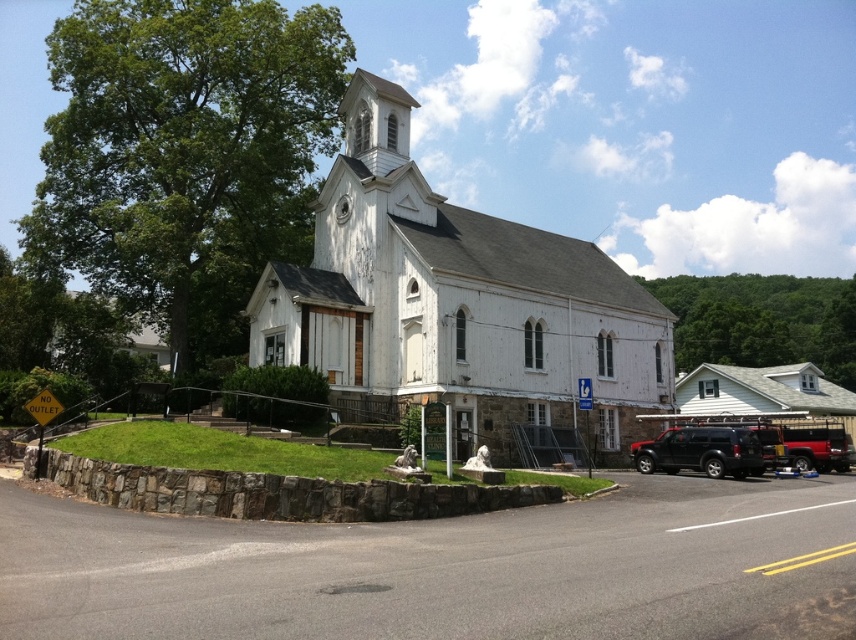
You are driving a black matte suv at lower right and want to park it perpendicular to the white wooden church at center. Given the space available, can you safely park the suv without touching the church?

The white wooden church at center might be wider than the black matte suv at lower right, so there is a possibility that the suv cannot park safely without overlapping the church. Check the actual width before attempting to park.

You are a delivery driver approaching the church on the paved road. The GPS shows a point at coordinates (x=456, y=301). What landmark does this point correspond to?

The point at coordinates (x=456, y=301) marks the white wooden church at center.

You are driving a delivery van that is 2 meters wide. You need to turn around your vehicle at the parking lot near the church. The parking lot has a turning radius of 6 meters. There are two SUVs parked here. Based on the image, can you determine if the black matte suv at lower right and the metallic red suv at lower right will block your turning path?

The black matte suv at lower right is thinner than metallic red suv at lower right. Since the black matte suv at lower right is thinner, it has a smaller width, so it might not block the turning path as much as the metallic red suv at lower right. However, both SUVs could potentially block the path depending on their exact positions. The metallic red suv at lower right is wider, so it might be more of an obstruction. To safely turn, you should check the distance between the two SUVs and ensure there is at 6